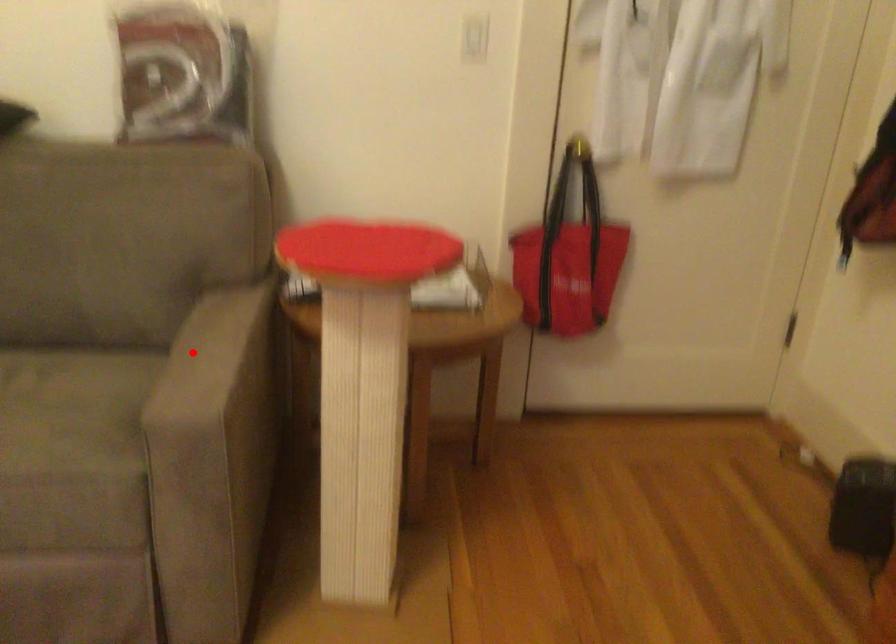
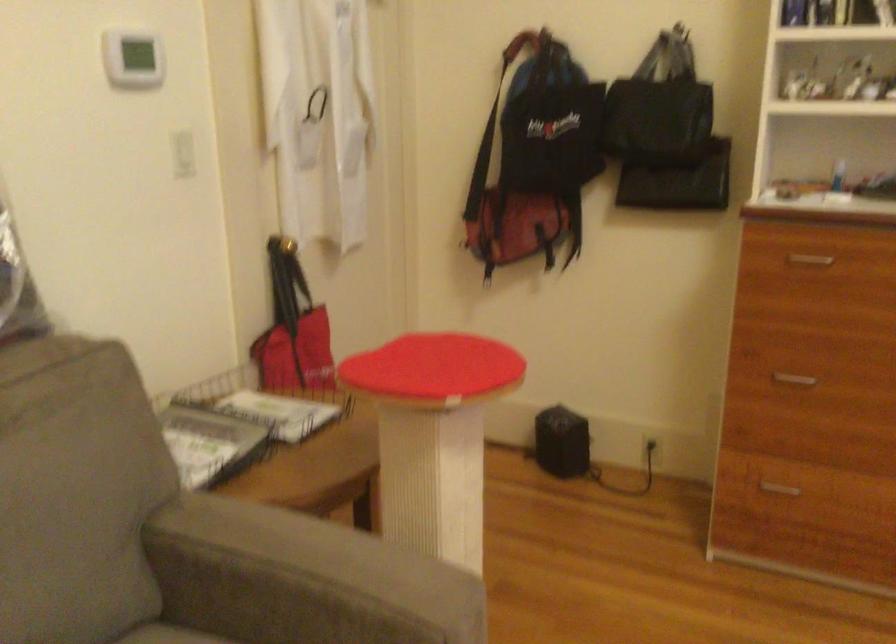
Where in the second image is the point corresponding to the highlighted location from the first image?

(302, 579)